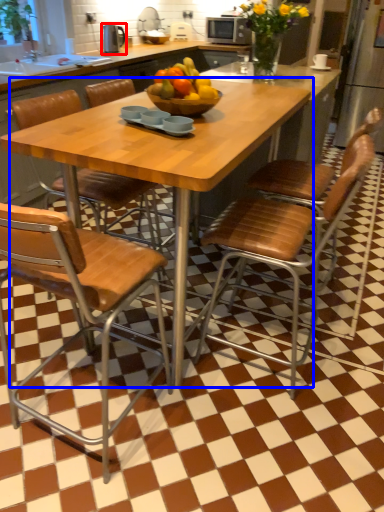
Question: Among these objects, which one is farthest to the camera, appliance (highlighted by a red box) or kitchen & dining room table (highlighted by a blue box)?

Choices:
 (A) appliance
 (B) kitchen & dining room table

Answer: (A)